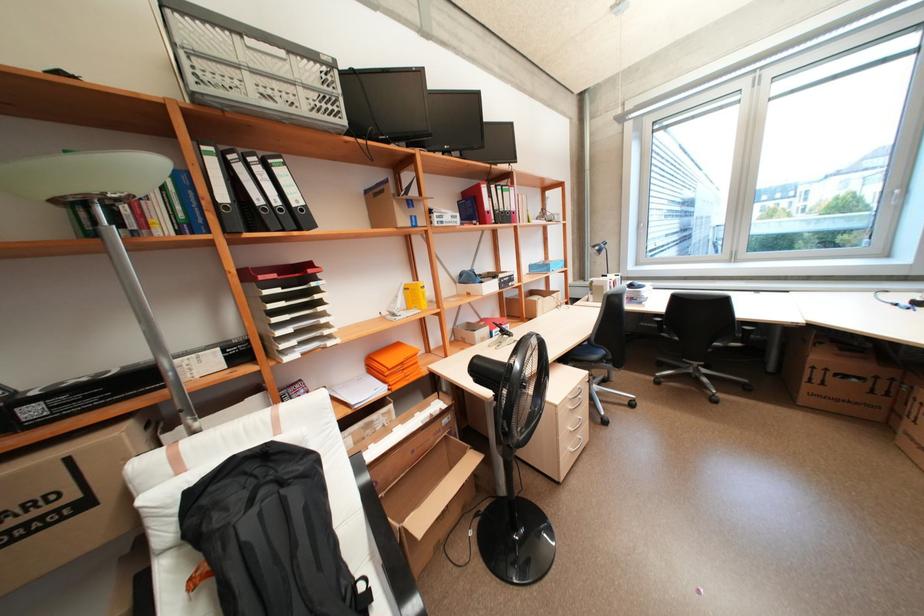
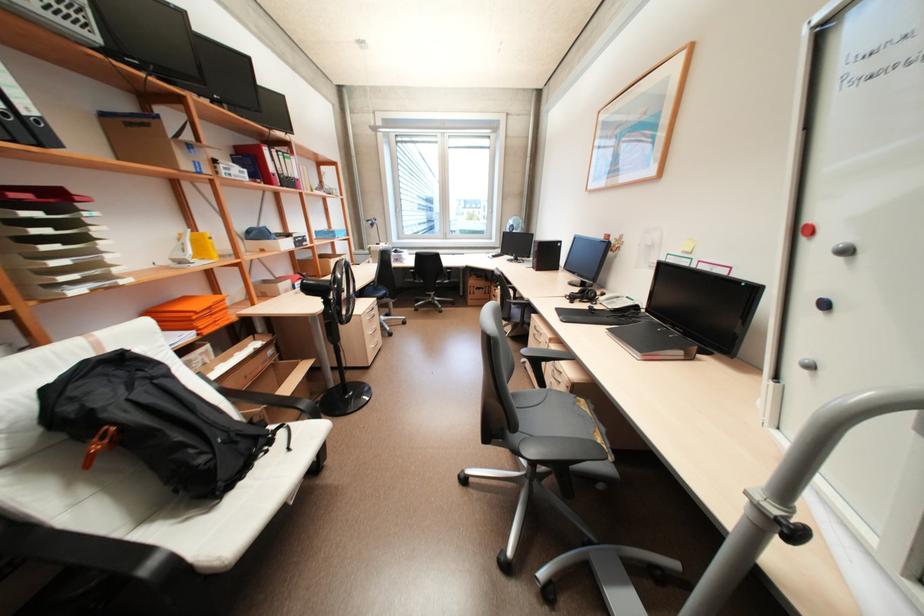
Where in the second image is the point corresponding to point 306,229 from the first image?

(46, 146)